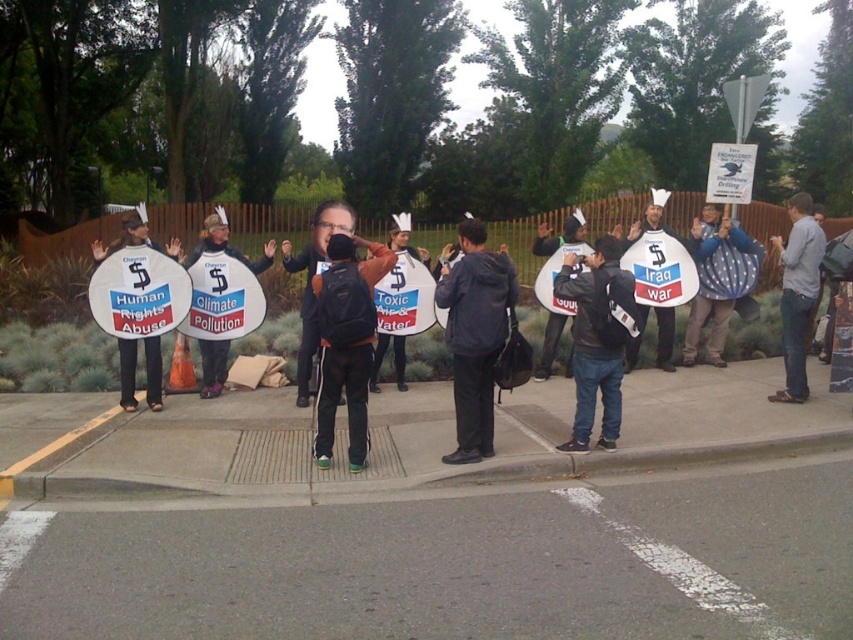
You are a photographer standing at the edge of the protest scene. You want to capture a photo that includes both the dark blue jacket at center and the white paper bag at center. Given that your camera has a minimum focus distance of 2 meters, will you be able to take the photo without moving closer?

The distance between the dark blue jacket at center and the white paper bag at center is 2.56 meters. Since the minimum focus distance is 2 meters, the photographer can capture both objects in the photo as the distance is sufficient.

You are a photographer standing at the camera position. You want to take a photo of the protest scene. The focus point of your camera is set at point (463, 323). If the depth of field covers up to 20 feet, will the protesters holding the signs be in focus?

The distance of point (463, 323) from the camera is 21.13 feet, which is beyond the 20 feet depth of field coverage. Therefore, the protesters holding the signs at that point will be slightly out of focus.

You are a photographer standing in front of the protest scene. You want to take a photo that includes both the point at (x=622, y=348) and the point at (x=785, y=273). Which point should you focus on first to ensure both are in sharp focus?

You should focus on the point closer to the viewer, which is point (x=622, y=348), to ensure both points are in sharp focus since focusing on the closer object helps keep the background in focus as well.